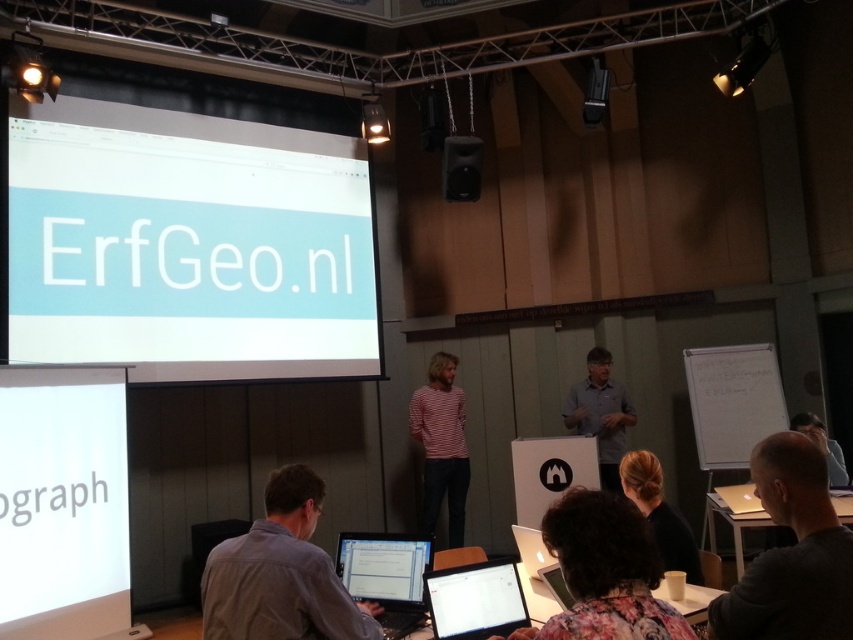
You are a presenter who needs to locate the projection screen in the room. According to the coordinates provided, where is the light blue matte projection screen at upper left positioned?

The light blue matte projection screen at upper left is positioned at point [189,244].

You are a participant in the presentation and want to get a better view of the black plastic speaker at upper center. Which direction should you move to look upwards from the gray shirt at lower center?

To look upwards toward the black plastic speaker at upper center from the gray shirt at lower center, you should move your gaze upward since the gray shirt at lower center is positioned below the black plastic speaker at upper center.

You are an attendee at this presentation and want to ask a question to the presenter. You need to stand up and point to the gray shirt at lower center and the black plastic speaker at upper center. Which one is closer to your current position when you are sitting at the table?

The gray shirt at lower center is closer to your current position because it is to the left of the black plastic speaker at upper center, which is further away.